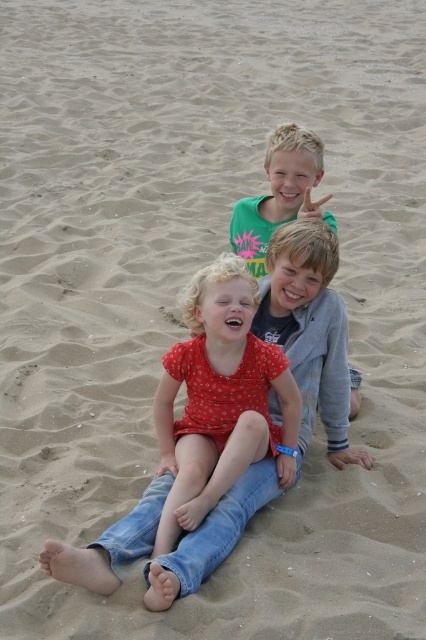
Question: Which of the following is the closest to the observer?

Choices:
 (A) green cotton shirt at upper center
 (B) red dotted shirt at center

Answer: (B)

Question: Can you confirm if red dotted shirt at center is positioned above green cotton shirt at upper center?

Choices:
 (A) no
 (B) yes

Answer: (A)

Question: Can you confirm if red dotted shirt at center is wider than green cotton shirt at upper center?

Choices:
 (A) no
 (B) yes

Answer: (B)

Question: Is red dotted shirt at center thinner than green cotton shirt at upper center?

Choices:
 (A) yes
 (B) no

Answer: (B)

Question: Among these points, which one is nearest to the camera?

Choices:
 (A) (164, 529)
 (B) (293, 154)

Answer: (A)

Question: Which of the following is the closest to the observer?

Choices:
 (A) green cotton shirt at upper center
 (B) red dotted shirt at center

Answer: (B)